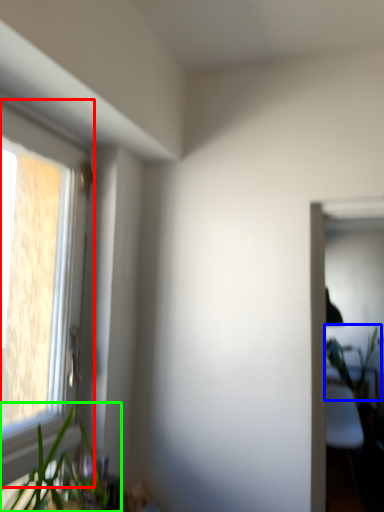
Question: Which object is positioned closest to window (highlighted by a red box)? Select from vegetation (highlighted by a blue box) and houseplant (highlighted by a green box).

Choices:
 (A) vegetation
 (B) houseplant

Answer: (B)